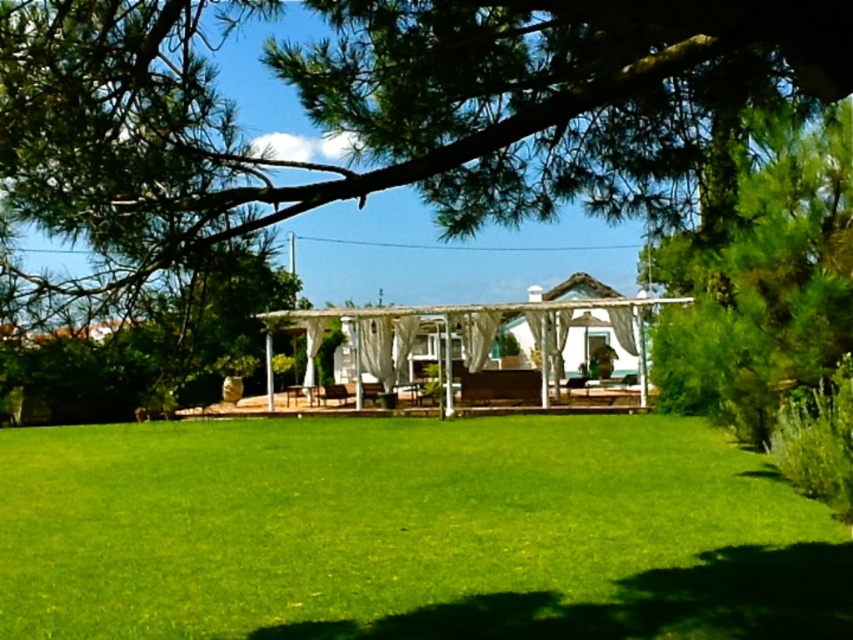
Looking at this image, you are planning to install a new lighting system for the green leafy tree at upper center and the white fabric gazebo at center. The minimum recommended distance between fixtures is 7 meters. Can you safely place the fixtures at their current positions?

The distance between the green leafy tree at upper center and the white fabric gazebo at center is 8.29 meters, which exceeds the minimum recommended distance of 7 meters. Therefore, it is safe to place the fixtures at their current positions.

You are planning to set up a picnic blanket in the shaded area under the green leafy tree at upper center and the white fabric gazebo at center. Which of these two structures provides more vertical space above the picnic blanket?

The green leafy tree at upper center is taller than the white fabric gazebo at center, so it provides more vertical space above the picnic blanket.

You are planning to set up a picnic blanket. You have a picnic blanket that is 2 meters wide. You see the green grass at center and the white fabric gazebo at center. Can you place your picnic blanket between them without overlapping either?

The green grass at center is positioned on the left side of white fabric gazebo at center. Since the distance between them isn